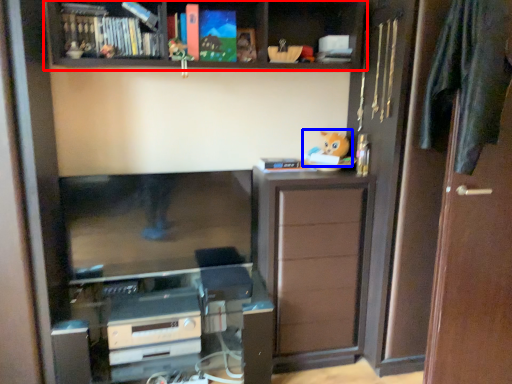
Question: Among these objects, which one is farthest to the camera, shelf (highlighted by a red box) or toy (highlighted by a blue box)?

Choices:
 (A) shelf
 (B) toy

Answer: (B)